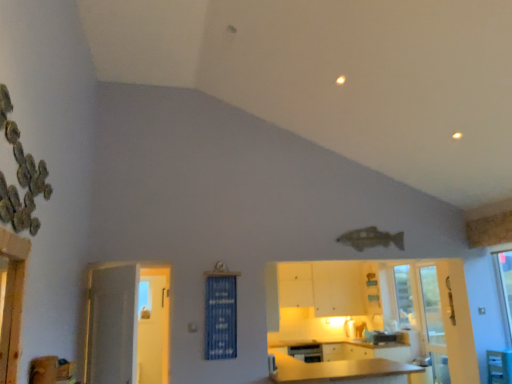
How much space does white glossy cabinets at center, the second cabinetry in the front-to-back sequence, occupy vertically?

white glossy cabinets at center, the second cabinetry in the front-to-back sequence, is 94.88 centimeters in height.

Locate an element on the screen. The image size is (512, 384). blue fabric curtain at center is located at coordinates (221, 317).

This screenshot has width=512, height=384. What do you see at coordinates (499, 366) in the screenshot?
I see `green plastic table at lower right` at bounding box center [499, 366].

This screenshot has width=512, height=384. Find the location of `green plastic table at lower right`. green plastic table at lower right is located at coordinates (499, 366).

How much space does matte wood cabinetry at center, which is the 2th cabinetry in back-to-front order, occupy horizontally?

It is 3.59 meters.

Where is `white glossy cabinets at center, the second cabinetry in the front-to-back sequence`? The width and height of the screenshot is (512, 384). white glossy cabinets at center, the second cabinetry in the front-to-back sequence is located at coordinates (338, 288).

From the green plastic table at lower right, count the 2nd cabinetry to the left and point to it. Please provide its 2D coordinates.

[(346, 364)]

Is point (508, 367) less distant than point (408, 357)?

That is True.

Does green plastic table at lower right have a larger size compared to matte wood cabinetry at center, which is the first cabinetry from front to back?

Incorrect, green plastic table at lower right is not larger than matte wood cabinetry at center, which is the first cabinetry from front to back.

Is green plastic table at lower right spatially inside matte wood cabinetry at center, which is the first cabinetry from front to back, or outside of it?

green plastic table at lower right is not inside matte wood cabinetry at center, which is the first cabinetry from front to back, it's outside.

From the blue fabric curtain at center, count 2nd cabinetry to the right and point to it. Please provide its 2D coordinates.

[(338, 288)]

Can you confirm if blue fabric curtain at center is wider than white glossy cabinets at center, the second cabinetry in the front-to-back sequence?

No, blue fabric curtain at center is not wider than white glossy cabinets at center, the second cabinetry in the front-to-back sequence.

Considering the positions of objects blue fabric curtain at center and white glossy cabinets at center, the second cabinetry in the front-to-back sequence, in the image provided, who is in front, blue fabric curtain at center or white glossy cabinets at center, the second cabinetry in the front-to-back sequence,?

blue fabric curtain at center is more forward.

Can you confirm if blue fabric curtain at center is bigger than white glossy cabinets at center, which is the 1th cabinetry in back-to-front order?

Actually, blue fabric curtain at center might be smaller than white glossy cabinets at center, which is the 1th cabinetry in back-to-front order.

Does green plastic table at lower right lie behind clear glass screen door at lower right?

No, green plastic table at lower right is in front of clear glass screen door at lower right.

Which is in front, point (501, 368) or point (433, 287)?

Point (501, 368)

From the image's perspective, between green plastic table at lower right and clear glass screen door at lower right, who is located below?

clear glass screen door at lower right appears lower in the image.

Can you confirm if green plastic table at lower right is wider than clear glass screen door at lower right?

Yes.

Is clear glass screen door at lower right turned away from white glossy door at left?

That's not correct — clear glass screen door at lower right is not looking away from white glossy door at left.

Is point (434, 268) positioned behind point (162, 313)?

Yes, point (434, 268) is farther from viewer.

Would you say clear glass screen door at lower right is to the left or to the right of white glossy door at left in the picture?

Clearly, clear glass screen door at lower right is on the right of white glossy door at left in the image.

Would you say clear glass screen door at lower right is inside or outside white glossy door at left?

clear glass screen door at lower right is located beyond the bounds of white glossy door at left.

Does point (388, 374) come closer to viewer compared to point (351, 305)?

Yes, it is in front of point (351, 305).

From a real-world perspective, is matte wood cabinetry at center, which is the 2th cabinetry in back-to-front order, physically below white glossy cabinets at center, the second cabinetry in the front-to-back sequence?

Indeed, from a real-world perspective, matte wood cabinetry at center, which is the 2th cabinetry in back-to-front order, is positioned beneath white glossy cabinets at center, the second cabinetry in the front-to-back sequence.

Is matte wood cabinetry at center, which is the first cabinetry from front to back, in contact with white glossy cabinets at center, the second cabinetry in the front-to-back sequence?

No, matte wood cabinetry at center, which is the first cabinetry from front to back, is not beside white glossy cabinets at center, the second cabinetry in the front-to-back sequence.

Which object is positioned more to the right, matte wood cabinetry at center, which is the first cabinetry from front to back, or white glossy cabinets at center, the second cabinetry in the front-to-back sequence?

From the viewer's perspective, white glossy cabinets at center, the second cabinetry in the front-to-back sequence, appears more on the right side.

Is yellow matte dishwasher at lower center positioned behind matte wood cabinetry at center, which is the first cabinetry from front to back?

Yes, yellow matte dishwasher at lower center is further from the viewer.

Can you confirm if yellow matte dishwasher at lower center is taller than matte wood cabinetry at center, which is the 2th cabinetry in back-to-front order?

In fact, yellow matte dishwasher at lower center may be shorter than matte wood cabinetry at center, which is the 2th cabinetry in back-to-front order.

From the image's perspective, which one is positioned higher, yellow matte dishwasher at lower center or matte wood cabinetry at center, which is the first cabinetry from front to back?

matte wood cabinetry at center, which is the first cabinetry from front to back, is shown above in the image.

Is point (319, 360) positioned behind point (281, 372)?

Yes, it is.

Is white glossy cabinets at center, which is the 1th cabinetry in back-to-front order, to the right of green plastic table at lower right from the viewer's perspective?

No.

Do you think white glossy cabinets at center, which is the 1th cabinetry in back-to-front order, is within green plastic table at lower right, or outside of it?

white glossy cabinets at center, which is the 1th cabinetry in back-to-front order, is not inside green plastic table at lower right, it's outside.

From the image's perspective, which one is positioned lower, white glossy cabinets at center, the second cabinetry in the front-to-back sequence, or green plastic table at lower right?

green plastic table at lower right appears lower in the image.

Is white glossy cabinets at center, the second cabinetry in the front-to-back sequence, facing towards green plastic table at lower right?

Yes.

Identify the location of cabinetry located below the green plastic table at lower right (from the image's perspective). This screenshot has height=384, width=512. (346, 364).

I want to click on cabinetry behind the blue fabric curtain at center, so click(x=338, y=288).

Based on their spatial positions, is white glossy cabinets at center, which is the 1th cabinetry in back-to-front order, or matte wood cabinetry at center, which is the 2th cabinetry in back-to-front order, further from clear glass screen door at lower right?

white glossy cabinets at center, which is the 1th cabinetry in back-to-front order, is further to clear glass screen door at lower right.

Looking at the image, which one is located closer to blue fabric curtain at center, clear glass screen door at lower right or green plastic table at lower right?

Among the two, clear glass screen door at lower right is located nearer to blue fabric curtain at center.

Based on their spatial positions, is blue fabric curtain at center or white glossy door at left further from green plastic table at lower right?

white glossy door at left.

Looking at the image, which one is located further to yellow matte dishwasher at lower center, blue fabric curtain at center or matte wood cabinetry at center, which is the first cabinetry from front to back?

The object further to yellow matte dishwasher at lower center is blue fabric curtain at center.

Estimate the real-world distances between objects in this image. Which object is further from white glossy door at left, yellow matte dishwasher at lower center or clear glass screen door at lower right?

clear glass screen door at lower right lies further to white glossy door at left than the other object.

Looking at the image, which one is located further to blue fabric curtain at center, clear glass screen door at lower right or white glossy cabinets at center, which is the 1th cabinetry in back-to-front order?

Based on the image, clear glass screen door at lower right appears to be further to blue fabric curtain at center.

Estimate the real-world distances between objects in this image. Which object is further from matte wood cabinetry at center, which is the first cabinetry from front to back, clear glass screen door at lower right or white glossy door at left?

white glossy door at left.

Looking at this image, looking at the image, which one is located closer to clear glass screen door at lower right, matte wood cabinetry at center, which is the first cabinetry from front to back, or green plastic table at lower right?

green plastic table at lower right.

You are a GUI agent. You are given a task and a screenshot of the screen. Output one action in this format:
    pyautogui.click(x=<x>, y=<y>)
    Task: Click on the table between blue fabric curtain at center and yellow matte dishwasher at lower center from front to back
    The width and height of the screenshot is (512, 384).
    Given the screenshot: What is the action you would take?
    pyautogui.click(x=499, y=366)

I want to click on dish washer between green plastic table at lower right and white glossy cabinets at center, which is the 1th cabinetry in back-to-front order, from front to back, so click(306, 352).

Locate an element on the screen. Image resolution: width=512 pixels, height=384 pixels. dish washer between blue fabric curtain at center and clear glass screen door at lower right from left to right is located at coordinates (306, 352).

The height and width of the screenshot is (384, 512). I want to click on door positioned between matte wood cabinetry at center, which is the 2th cabinetry in back-to-front order, and white glossy cabinets at center, which is the 1th cabinetry in back-to-front order, from near to far, so click(x=127, y=324).